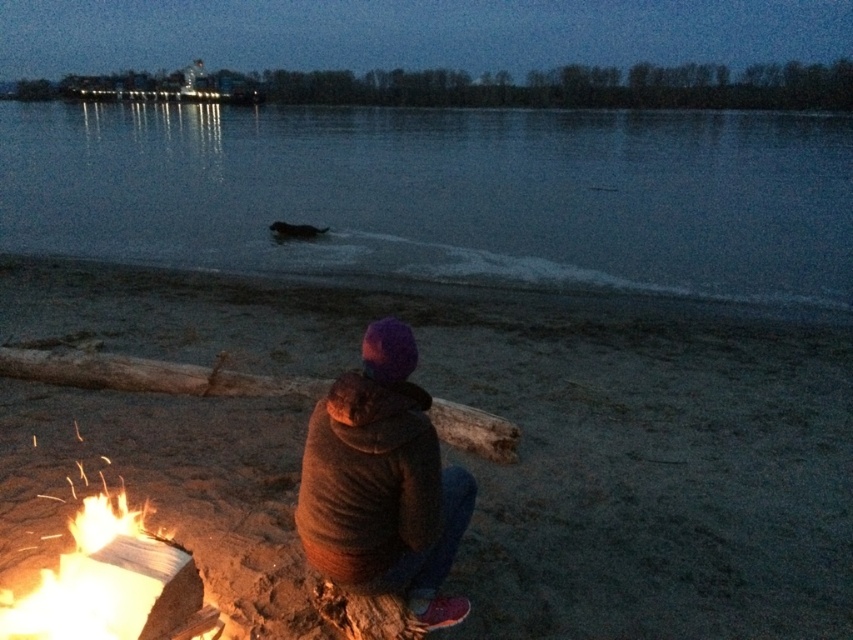
Question: Does dark water at center have a smaller size compared to flaming wood at lower left?

Choices:
 (A) no
 (B) yes

Answer: (A)

Question: Where is purple woolen hat at center located in relation to flaming wood at lower left in the image?

Choices:
 (A) left
 (B) right

Answer: (B)

Question: Which point is closer to the camera taking this photo?

Choices:
 (A) (77, 605)
 (B) (372, 259)
 (C) (462, 612)

Answer: (A)

Question: Can you confirm if purple woolen hat at center is smaller than flaming wood at lower left?

Choices:
 (A) yes
 (B) no

Answer: (B)

Question: Based on their relative distances, which object is nearer to the dark water at center?

Choices:
 (A) purple woolen hat at center
 (B) flaming wood at lower left

Answer: (B)

Question: Which object is positioned farthest from the flaming wood at lower left?

Choices:
 (A) purple woolen hat at center
 (B) dark water at center

Answer: (B)